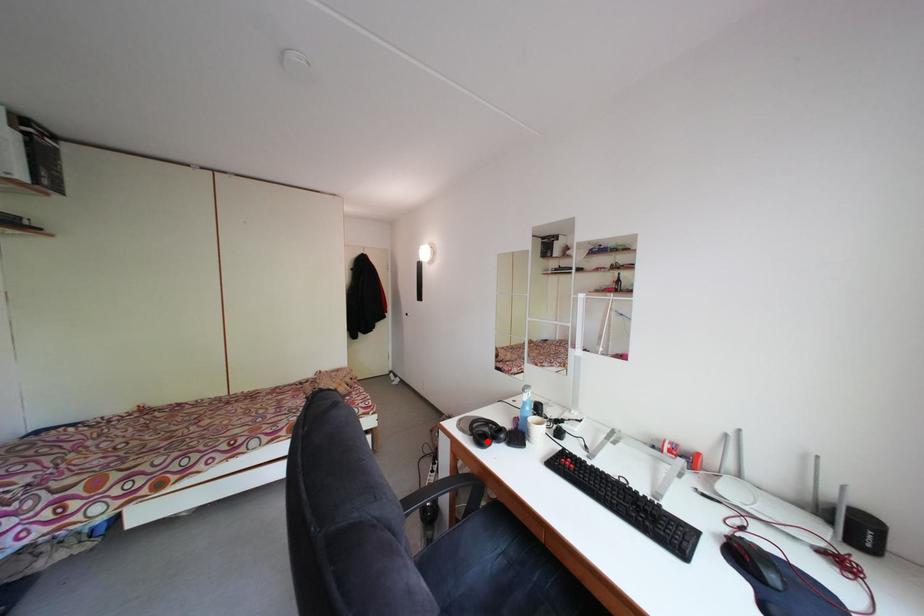
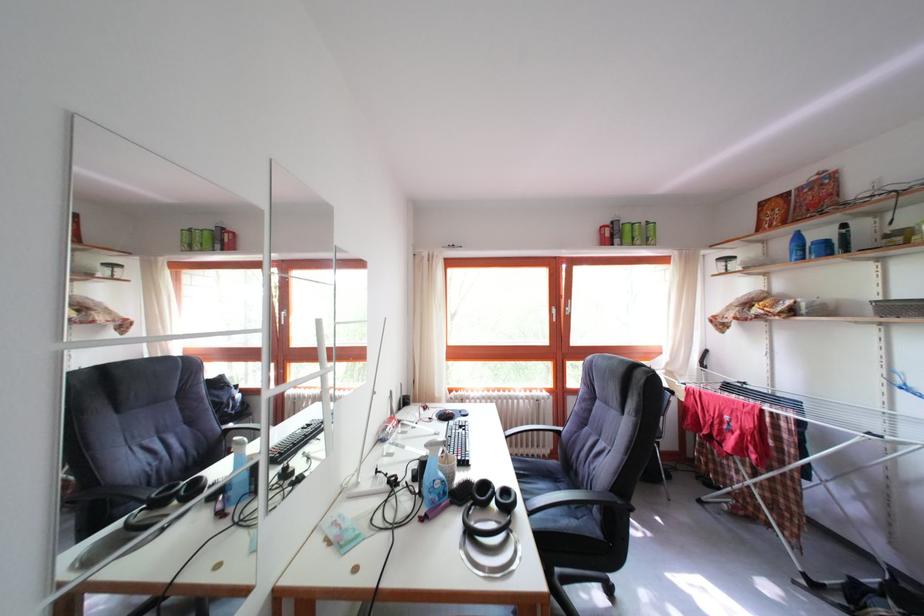
Question: I am providing you with two images of the same scene from different viewpoints. Image1 has a red point marked. In image2, the corresponding 3D location appears at what relative position? Reply with the corresponding letter.

Choices:
 (A) Closer
 (B) Farther

Answer: (A)